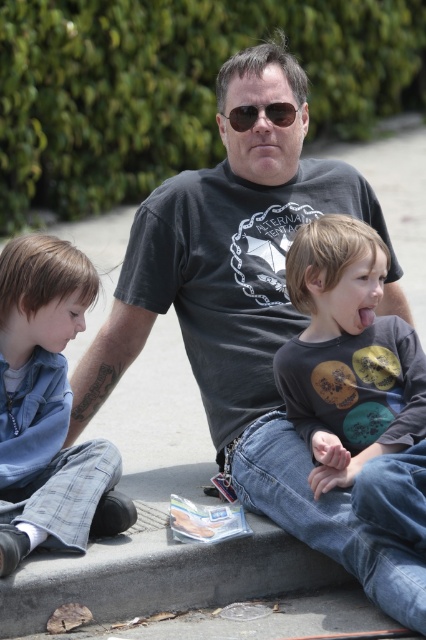
Between matte gray shirt at center and blue denim pants at lower left, which one is positioned higher?

matte gray shirt at center

Is matte gray shirt at center further to camera compared to blue denim pants at lower left?

Yes, matte gray shirt at center is behind blue denim pants at lower left.

Locate an element on the screen. The width and height of the screenshot is (426, 640). matte gray shirt at center is located at coordinates (348, 353).

Where is `matte gray shirt at center`? The height and width of the screenshot is (640, 426). matte gray shirt at center is located at coordinates (348, 353).

Who is lower down, matte gray shirt at center or sunglasses at center?

Positioned lower is matte gray shirt at center.

Is matte gray shirt at center bigger than sunglasses at center?

Yes, matte gray shirt at center is bigger than sunglasses at center.

Is point (347, 401) closer to viewer compared to point (291, 113)?

Yes, it is.

At what (x,y) coordinates should I click in order to perform the action: click on matte gray shirt at center. Please return your answer as a coordinate pair (x, y). Looking at the image, I should click on [x=348, y=353].

Who is lower down, blue denim pants at lower left or sunglasses at center?

Positioned lower is blue denim pants at lower left.

Does point (9, 369) come farther from viewer compared to point (279, 115)?

That is False.

Where is `blue denim pants at lower left`? blue denim pants at lower left is located at coordinates (46, 404).

The image size is (426, 640). In order to click on blue denim pants at lower left in this screenshot , I will do `click(46, 404)`.